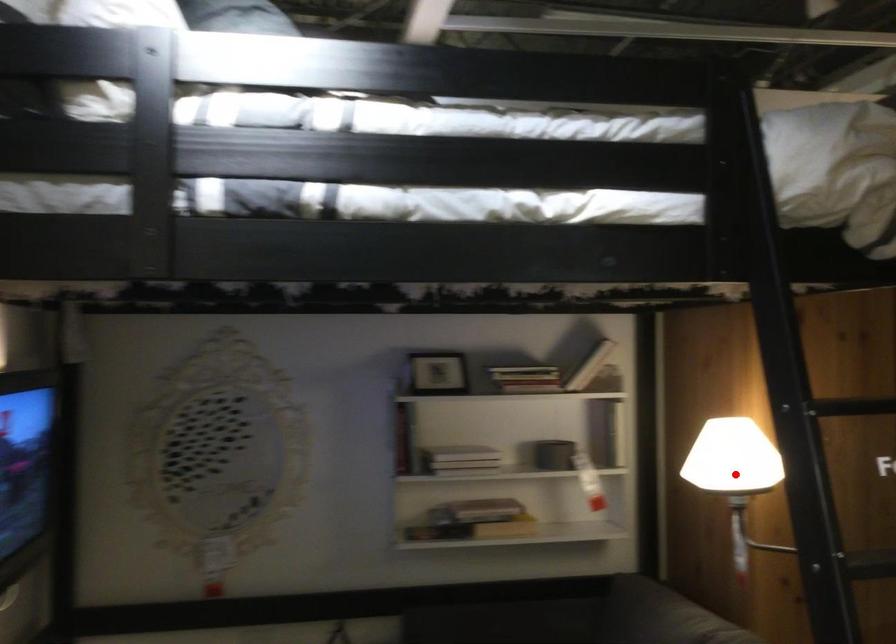
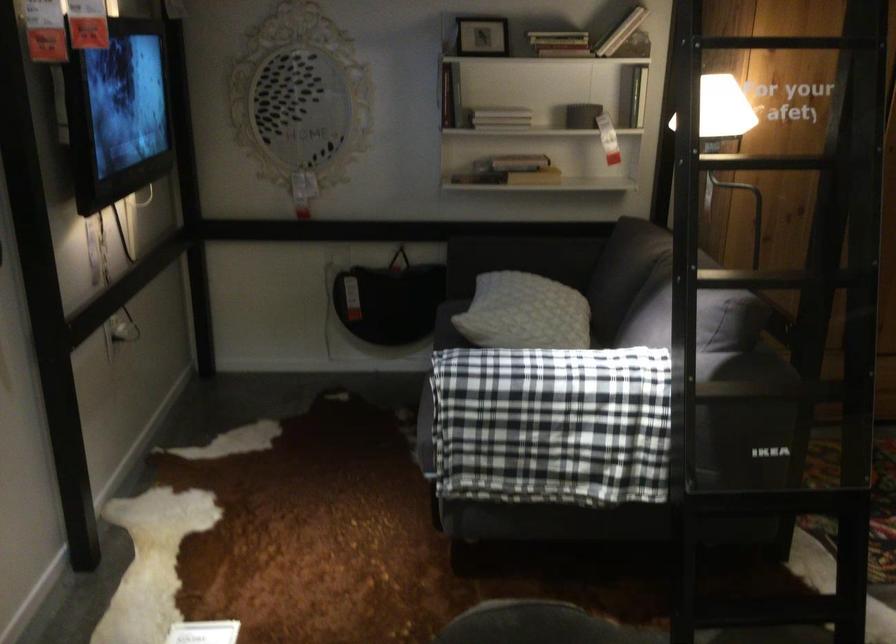
Question: I am providing you with two images of the same scene from different viewpoints. A red point is marked on the first image. Is the red point's position out of view in image 2?

Choices:
 (A) Yes
 (B) No

Answer: (A)